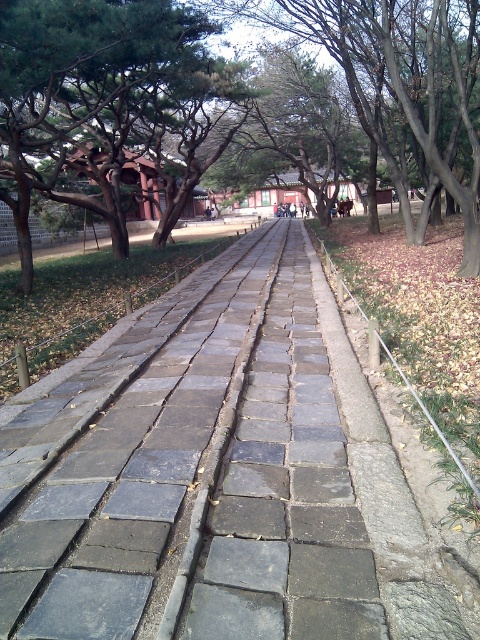
Question: Considering the relative positions of gray stone pavement at center and green leafy tree at center in the image provided, where is gray stone pavement at center located with respect to green leafy tree at center?

Choices:
 (A) below
 (B) above

Answer: (A)

Question: Which point is closer to the camera?

Choices:
 (A) (394, 168)
 (B) (310, 307)

Answer: (B)

Question: Is gray stone pavement at center closer to the viewer compared to green leafy tree at center?

Choices:
 (A) yes
 (B) no

Answer: (A)

Question: Does gray stone pavement at center have a lesser width compared to green leafy tree at center?

Choices:
 (A) yes
 (B) no

Answer: (A)